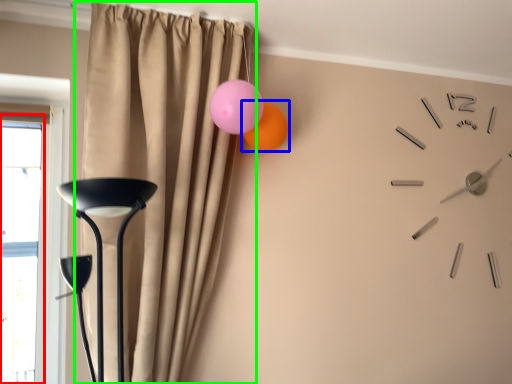
Question: Based on their relative distances, which object is farther from window (highlighted by a red box)? Choose from balloon (highlighted by a blue box) and curtain (highlighted by a green box).

Choices:
 (A) balloon
 (B) curtain

Answer: (A)